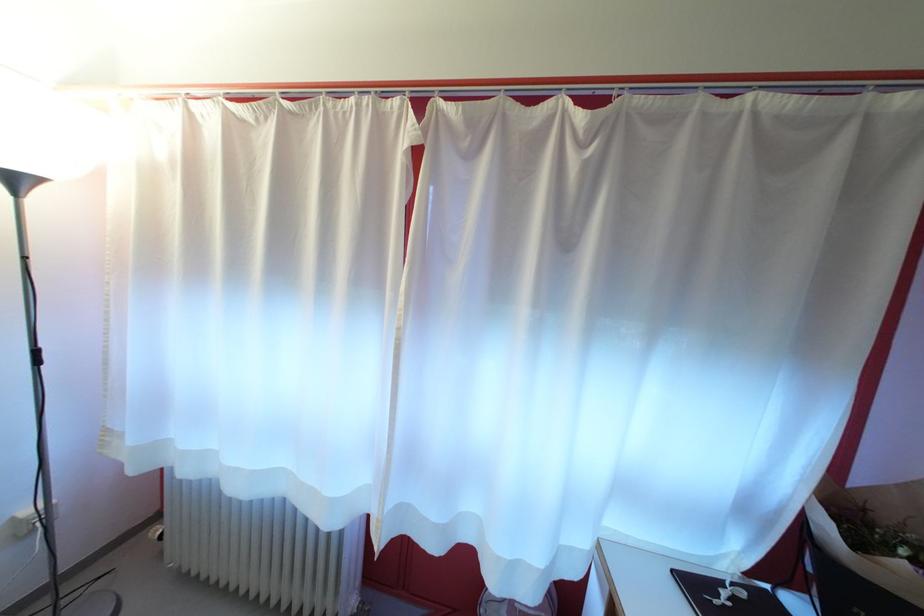
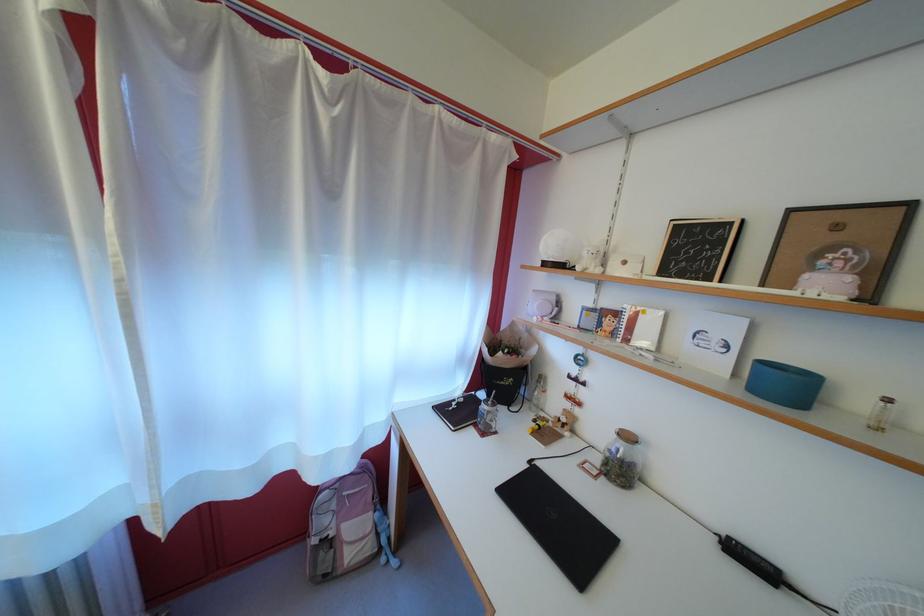
Locate, in the second image, the point that corresponds to (572,246) in the first image.

(335, 193)